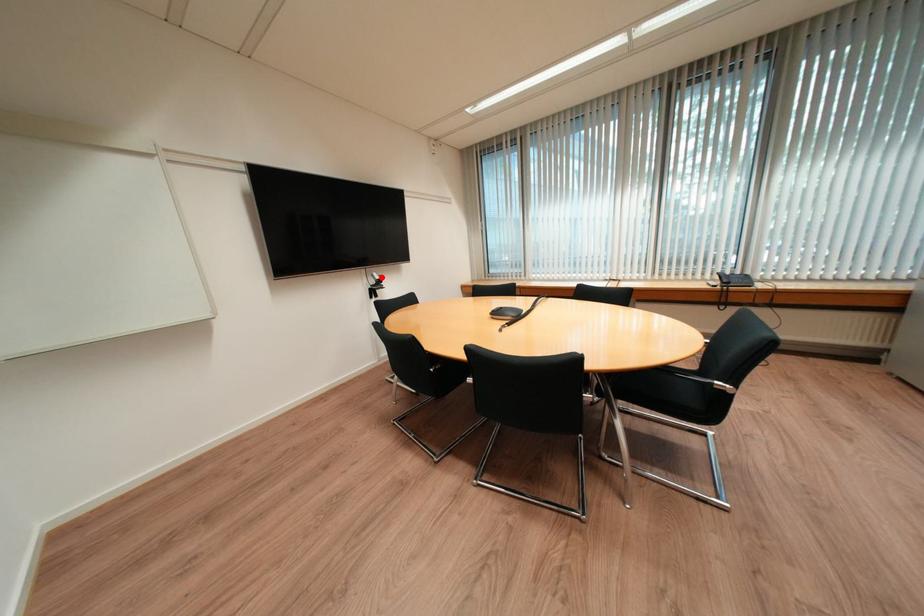
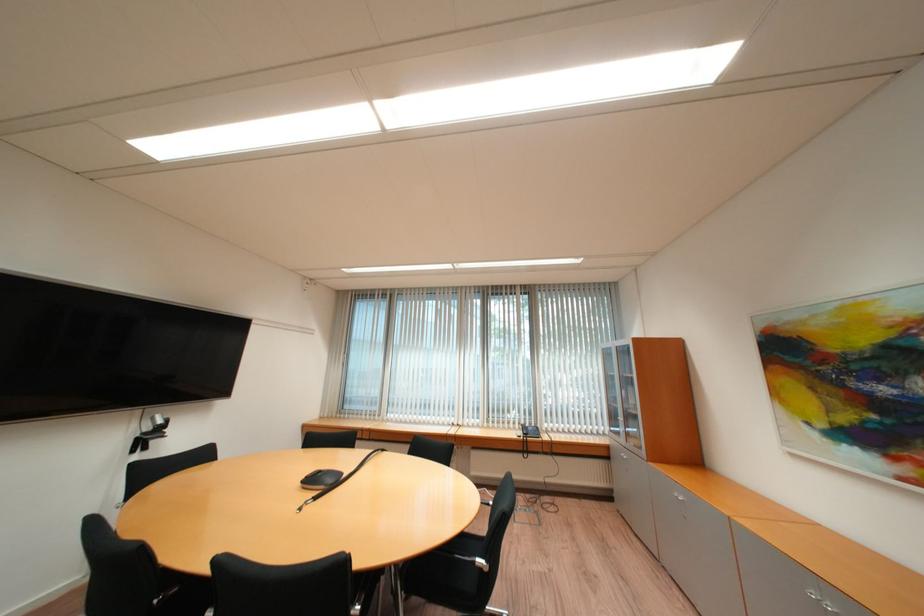
Question: I am providing you with two images of the same scene from different viewpoints. A red point is shown in image1. For the corresponding object point in image2, is it positioned nearer or farther from the camera?

Choices:
 (A) Nearer
 (B) Farther

Answer: (B)